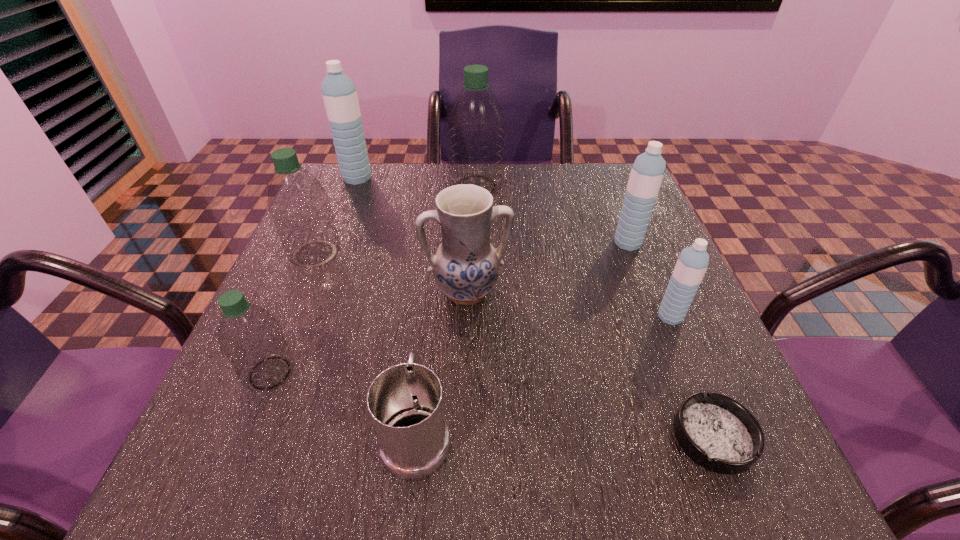
Where is `object that is at the near right corner`? The height and width of the screenshot is (540, 960). object that is at the near right corner is located at coordinates (717, 432).

Where is `vacant region at the far edge of the desktop`? This screenshot has width=960, height=540. vacant region at the far edge of the desktop is located at coordinates (516, 206).

You are a GUI agent. You are given a task and a screenshot of the screen. Output one action in this format:
    pyautogui.click(x=<x>, y=<y>)
    Task: Click on the free space at the near edge of the desktop
    The image size is (960, 540).
    Given the screenshot: What is the action you would take?
    pyautogui.click(x=613, y=475)

The width and height of the screenshot is (960, 540). In order to click on vacant space at the right edge of the desktop in this screenshot , I will do `click(659, 248)`.

This screenshot has width=960, height=540. I want to click on vacant area at the far left corner, so click(345, 200).

Find the location of a particular element. This screenshot has width=960, height=540. free spot at the near left corner of the desktop is located at coordinates click(204, 493).

Where is `blank space at the far right corner`? blank space at the far right corner is located at coordinates (593, 192).

In the image, there is a desktop. At what (x,y) coordinates should I click in order to perform the action: click on free space at the near right corner. Please return your answer as a coordinate pair (x, y). The width and height of the screenshot is (960, 540). Looking at the image, I should click on (742, 474).

Where is `vacant region between the smallest green water bottle and the biggest green water bottle`? The height and width of the screenshot is (540, 960). vacant region between the smallest green water bottle and the biggest green water bottle is located at coordinates (373, 279).

Find the location of a particular element. The width and height of the screenshot is (960, 540). vacant area between the second smallest blue water bottle and the smallest blue water bottle is located at coordinates (649, 280).